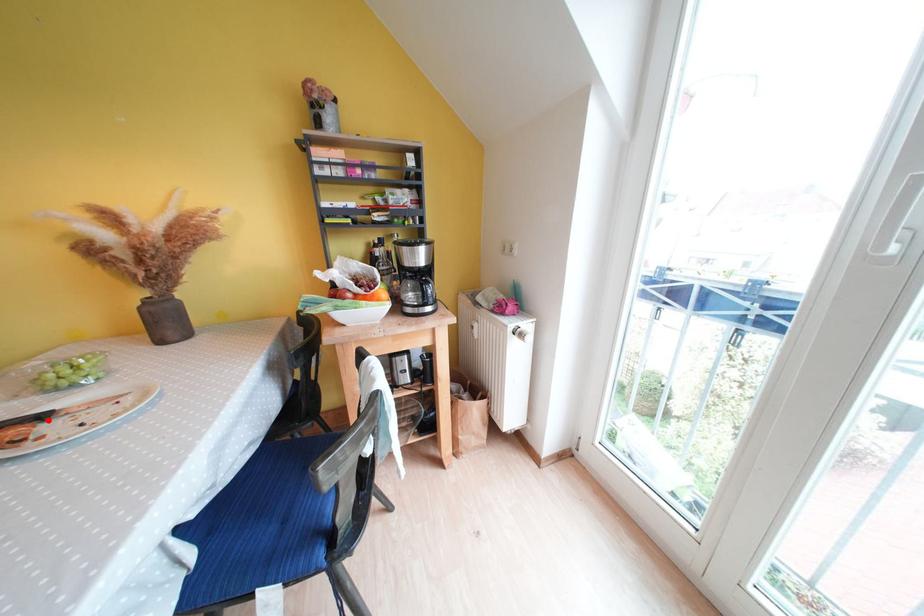
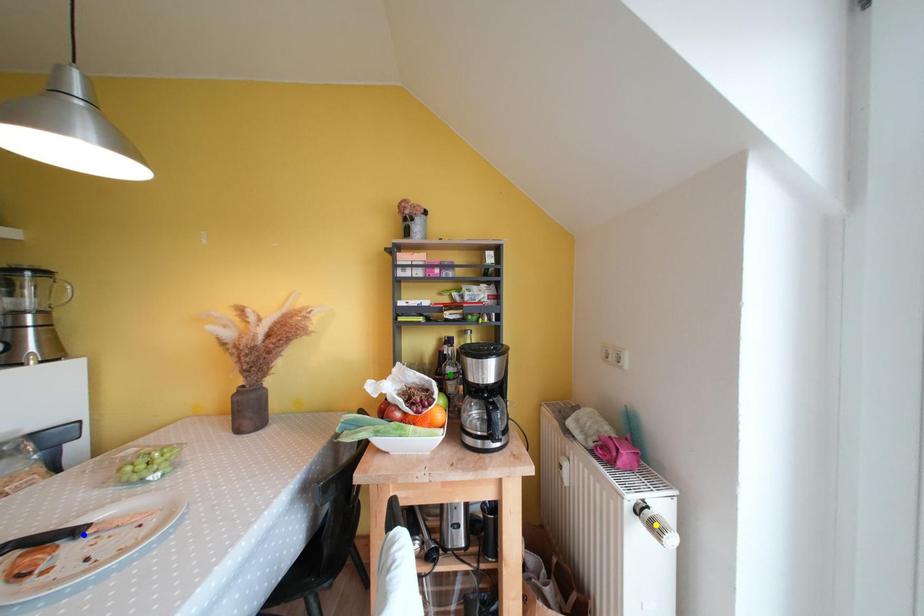
Question: I am providing you with two images of the same scene from different viewpoints. A red point is marked on the first image. You are given multiple points on the second image. Which point in image 2 represents the same 3d spot as the red point in image 1?

Choices:
 (A) blue point
 (B) green point
 (C) yellow point

Answer: (A)